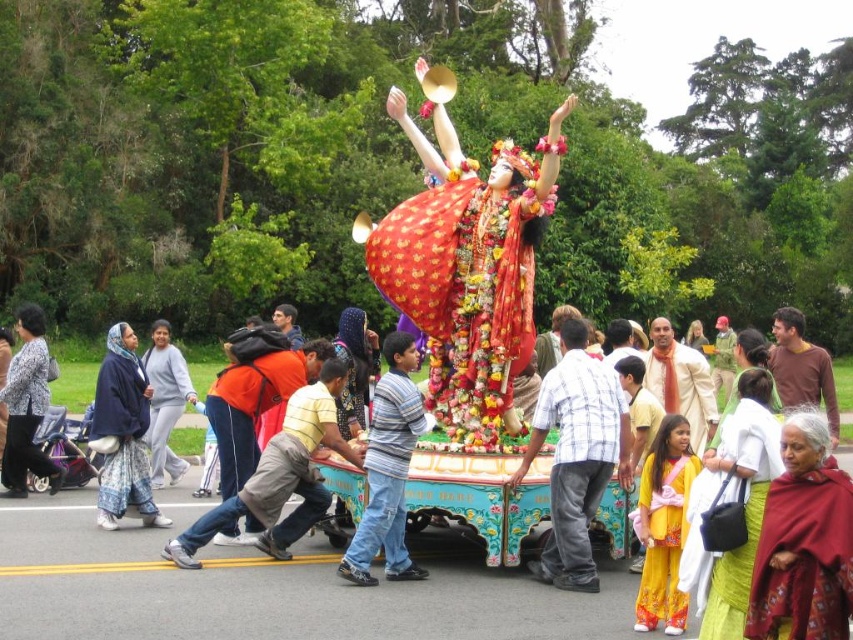
Question: Which is nearer to the matte black jacket at lower left?

Choices:
 (A) maroon fabric shawl at lower right
 (B) shiny red fabric at center
 (C) gray sweatshirt at left

Answer: (C)

Question: Can you confirm if blue printed fabric at left is positioned below gray sweatshirt at left?

Choices:
 (A) no
 (B) yes

Answer: (B)

Question: Can you confirm if yellow cotton dress at center is thinner than matte black jacket at lower left?

Choices:
 (A) yes
 (B) no

Answer: (A)

Question: Considering the relative positions of shiny red fabric at center and matte black jacket at lower left in the image provided, where is shiny red fabric at center located with respect to matte black jacket at lower left?

Choices:
 (A) below
 (B) above

Answer: (B)

Question: Which point is closer to the camera taking this photo?

Choices:
 (A) (329, 445)
 (B) (494, 276)

Answer: (A)

Question: Which object appears closest to the camera in this image?

Choices:
 (A) matte black jacket at lower left
 (B) yellow cotton dress at center
 (C) shiny red fabric at center
 (D) blue printed fabric at left

Answer: (B)